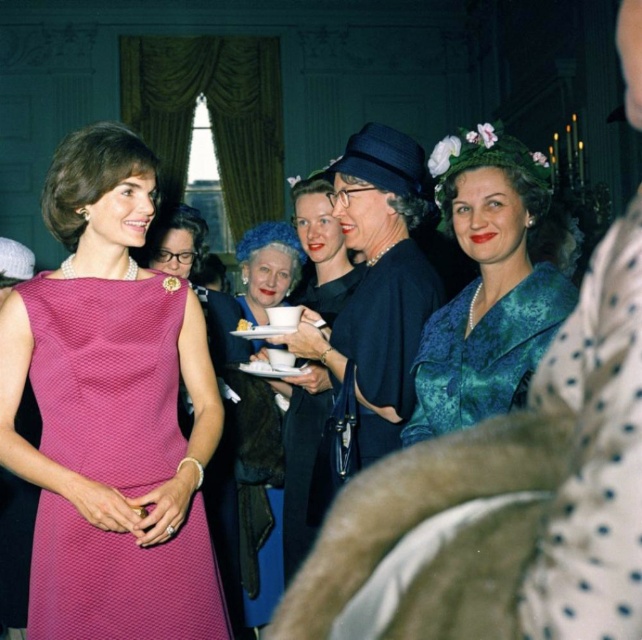
Which of these two, pink textured dress at center or velvet black dress at center, stands shorter?

pink textured dress at center

Locate an element on the screen. This screenshot has width=642, height=640. pink textured dress at center is located at coordinates (108, 376).

Identify the location of pink textured dress at center. This screenshot has height=640, width=642. (108, 376).

Does pink textured dress at center appear under teal velvet dress at center?

Indeed, pink textured dress at center is positioned under teal velvet dress at center.

Between pink textured dress at center and teal velvet dress at center, which one has more height?

pink textured dress at center is taller.

Between point (132, 576) and point (559, 292), which one is positioned in front?

Point (559, 292) is in front.

Image resolution: width=642 pixels, height=640 pixels. In order to click on pink textured dress at center in this screenshot , I will do `click(108, 376)`.

Who is more distant from viewer, (451,148) or (239,428)?

Positioned behind is point (239,428).

Which is in front, point (501, 408) or point (272, 556)?

Point (501, 408)

At what (x,y) coordinates should I click in order to perform the action: click on teal velvet dress at center. Please return your answer as a coordinate pair (x, y). This screenshot has height=640, width=642. Looking at the image, I should click on (487, 285).